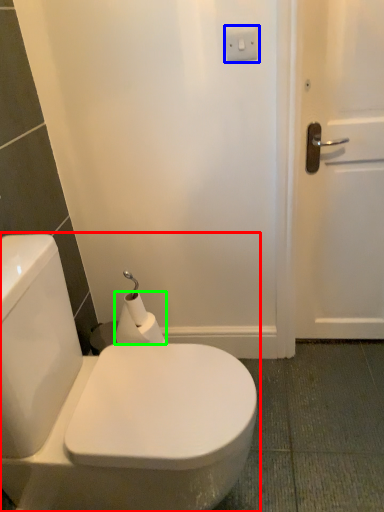
Question: Based on their relative distances, which object is nearer to toilet (highlighted by a red box)? Choose from electric outlet (highlighted by a blue box) and toilet paper (highlighted by a green box).

Choices:
 (A) electric outlet
 (B) toilet paper

Answer: (B)